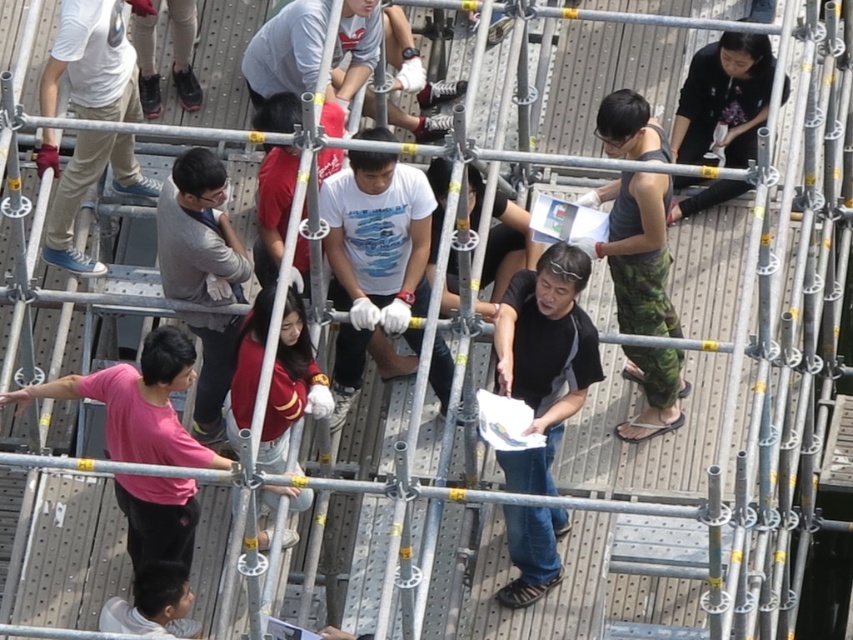
Question: Which of the following is the farthest from the observer?

Choices:
 (A) (747, 152)
 (B) (283, 435)
 (C) (515, 278)
 (D) (608, 182)

Answer: (D)

Question: In this image, where is gray matte shirt at center located relative to maroon fabric shirt at center?

Choices:
 (A) left
 (B) right

Answer: (A)

Question: Among these points, which one is nearest to the camera?

Choices:
 (A) (199, 230)
 (B) (683, 387)
 (C) (453, 298)
 (D) (378, 266)

Answer: (A)

Question: Estimate the real-world distances between objects in this image. Which object is closer to the matte white sneakers at upper left?

Choices:
 (A) maroon fabric shirt at center
 (B) gray matte shirt at center
 (C) black shirt at center
 (D) camouflage pants at right

Answer: (B)

Question: Can you confirm if maroon fabric shirt at center is bigger than black shirt at center?

Choices:
 (A) no
 (B) yes

Answer: (B)

Question: Does maroon fabric shirt at center come in front of black shirt at center?

Choices:
 (A) yes
 (B) no

Answer: (A)